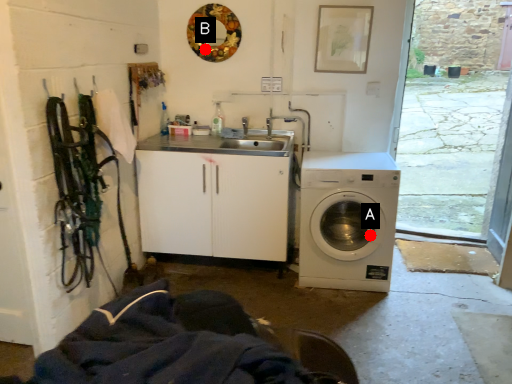
Question: Two points are circled on the image, labeled by A and B beside each circle. Which point is closer to the camera?

Choices:
 (A) A is closer
 (B) B is closer

Answer: (A)